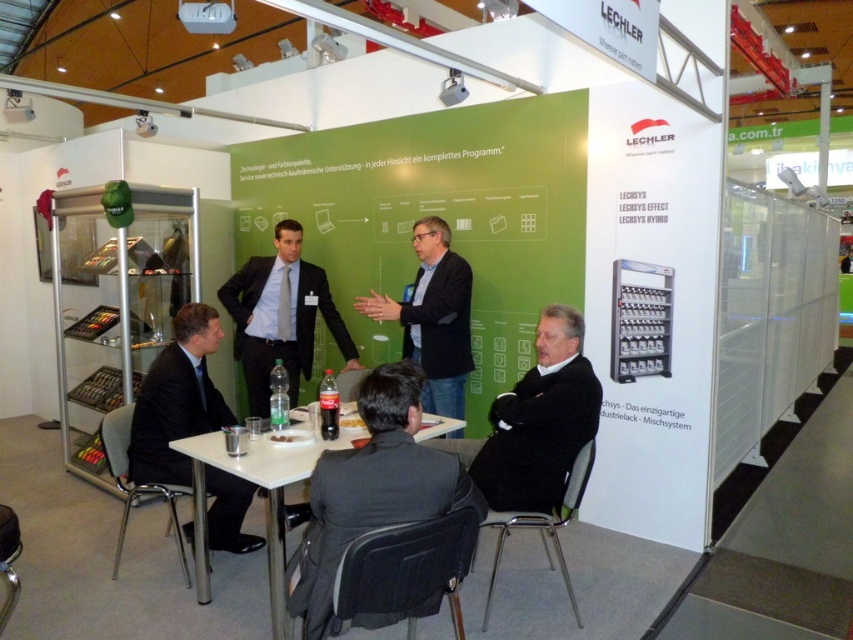
Question: Is black matte suit at lower right positioned in front of white plastic table at center?

Choices:
 (A) no
 (B) yes

Answer: (A)

Question: Which point is closer to the camera?

Choices:
 (A) black matte suit at lower left
 (B) matte black suit at center

Answer: (A)

Question: Considering the real-world distances, which object is farthest from the black fabric jacket at center?

Choices:
 (A) black matte suit at lower left
 (B) matte black suit at center

Answer: (A)

Question: Is black matte suit at lower left positioned behind white plastic table at center?

Choices:
 (A) no
 (B) yes

Answer: (B)

Question: Is matte black suit at center below white plastic table at center?

Choices:
 (A) no
 (B) yes

Answer: (A)

Question: Which point is closer to the camera?

Choices:
 (A) black fabric jacket at center
 (B) black matte suit at lower left
 (C) black matte suit at lower right
 (D) dark gray fabric business suit at center

Answer: (D)